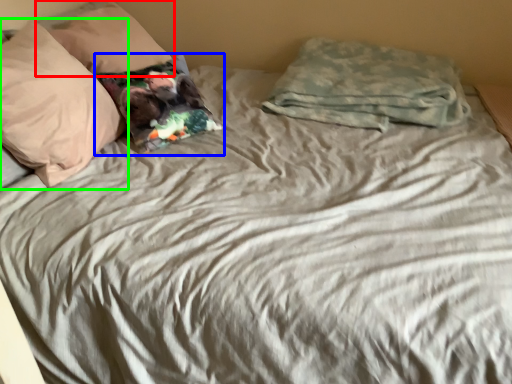
Question: Which is farther away from pillow (highlighted by a red box)? pillow (highlighted by a blue box) or pillow (highlighted by a green box)?

Choices:
 (A) pillow
 (B) pillow

Answer: (B)